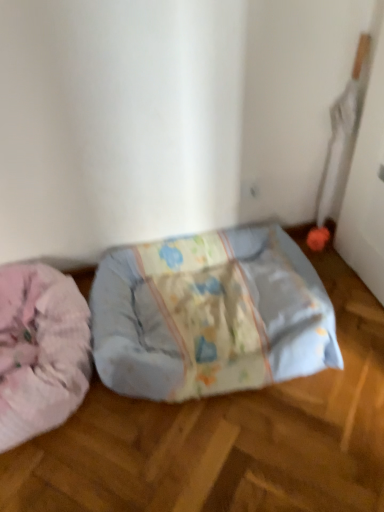
Question: From the image's perspective, is light blue fabric pet bed at center positioned above or below fluffy pink dog bed at left?

Choices:
 (A) below
 (B) above

Answer: (B)

Question: Based on their positions, is light blue fabric pet bed at center located to the left or right of fluffy pink dog bed at left?

Choices:
 (A) right
 (B) left

Answer: (A)

Question: In terms of size, does light blue fabric pet bed at center appear bigger or smaller than fluffy pink dog bed at left?

Choices:
 (A) small
 (B) big

Answer: (B)

Question: From the image's perspective, relative to light blue fabric pet bed at center, is fluffy pink dog bed at left above or below?

Choices:
 (A) above
 (B) below

Answer: (B)

Question: From a real-world perspective, is fluffy pink dog bed at left above or below light blue fabric pet bed at center?

Choices:
 (A) above
 (B) below

Answer: (A)

Question: Looking at the image, does fluffy pink dog bed at left seem bigger or smaller compared to light blue fabric pet bed at center?

Choices:
 (A) big
 (B) small

Answer: (B)

Question: Is fluffy pink dog bed at left taller or shorter than light blue fabric pet bed at center?

Choices:
 (A) tall
 (B) short

Answer: (B)